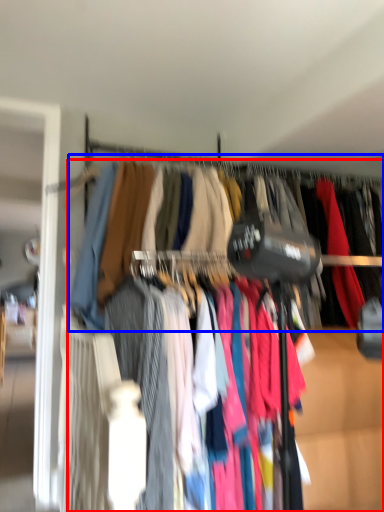
Question: Which point is closer to the camera, trousers (highlighted by a red box) or closet (highlighted by a blue box)?

Choices:
 (A) trousers
 (B) closet

Answer: (A)